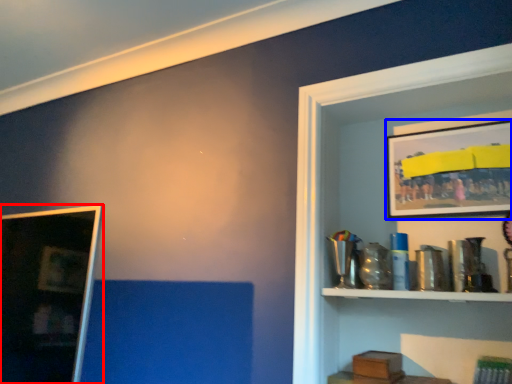
Question: Which of the following is the farthest to the observer, picture frame (highlighted by a red box) or picture frame (highlighted by a blue box)?

Choices:
 (A) picture frame
 (B) picture frame

Answer: (B)